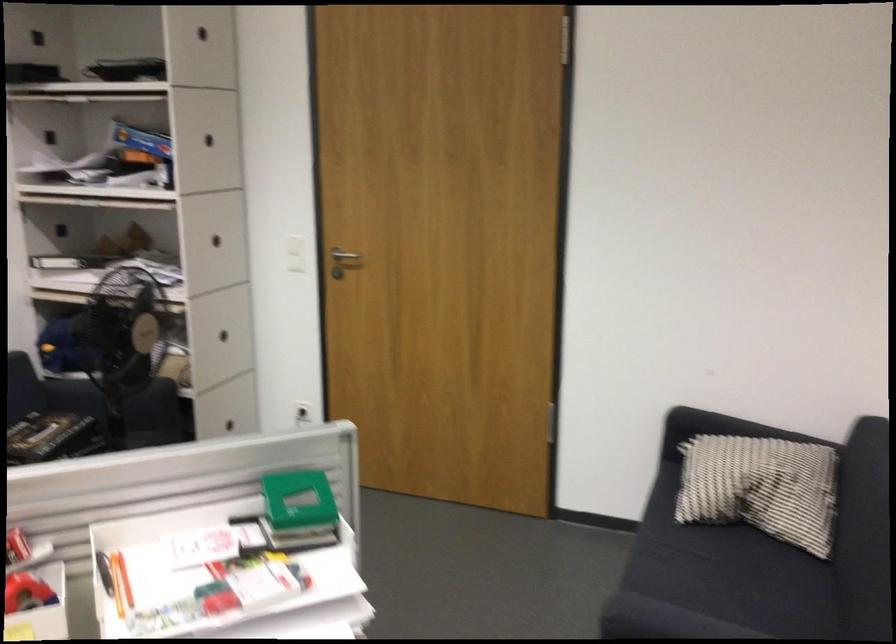
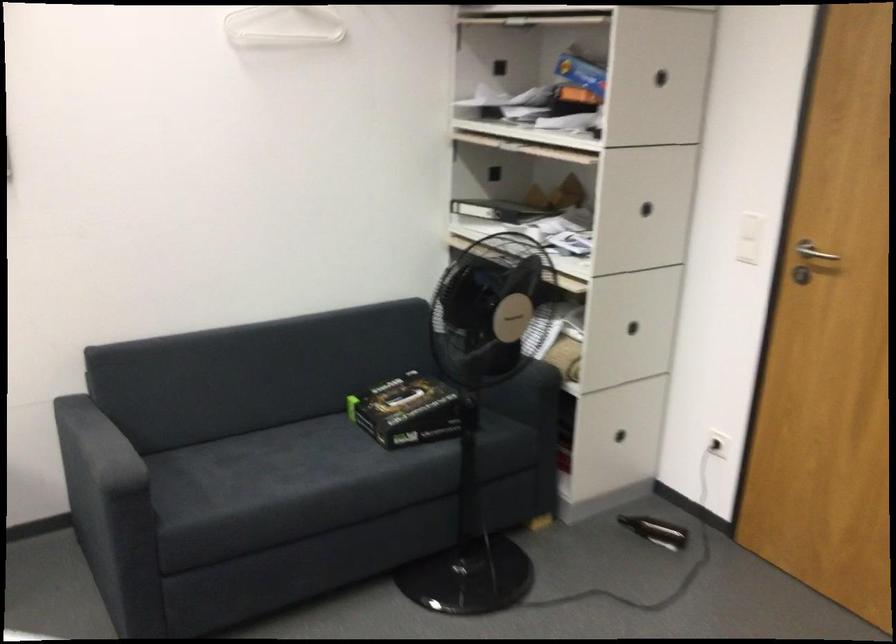
In the second image, find the point that corresponds to the point at 341,259 in the first image.

(813, 252)